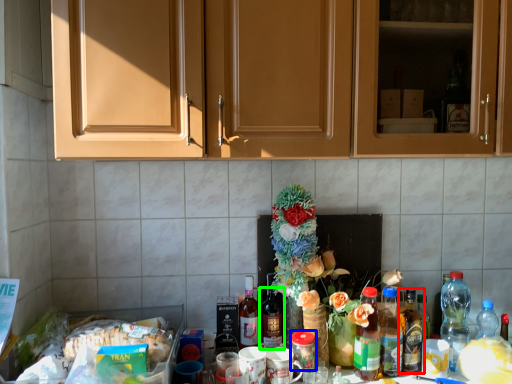
Question: Which is farther away from bottle (highlighted by a red box)? beverage (highlighted by a blue box) or bottle (highlighted by a green box)?

Choices:
 (A) beverage
 (B) bottle

Answer: (B)